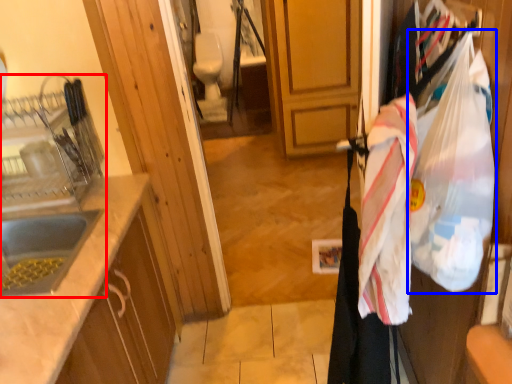
Question: Which object appears closest to the camera in this image, sink (highlighted by a red box) or grocery bag (highlighted by a blue box)?

Choices:
 (A) sink
 (B) grocery bag

Answer: (B)